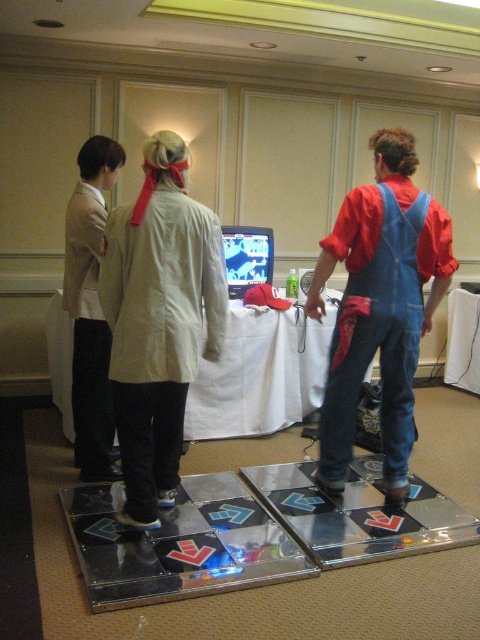
Consider the image. You are organizing a small event and need to place a 1.5 meter long banner on the table. Given the white cloth table at center and the light beige fabric jacket at left, can the banner fit on the table?

The white cloth table at center has a larger size compared to the light beige fabric jacket at left. Since the table is larger, it can accommodate the 1.5 meter long banner.

You are a photographer trying to capture a group photo of the light beige fabric coat at center and the denim overalls at center. Since you want to ensure both are clearly visible, which of the two should you focus on first to account for their size difference?

The light beige fabric coat at center is smaller than the denim overalls at center, so you should focus on the light beige fabric coat at center first to ensure its details are captured clearly before adjusting for the larger denim overalls at center.

You are organizing a small event and need to decide where to place a new decorative item. The item is 10 cm thick. You have two options from the scene to place it next to or on top of. Which object can accommodate the item based on their thickness? Please choose between the denim overalls at center and the white cloth table at center.

The white cloth table at center can accommodate the 10 cm thick item because the denim overalls at center is thinner than the white cloth table at center, implying the table has sufficient thickness to support the item.